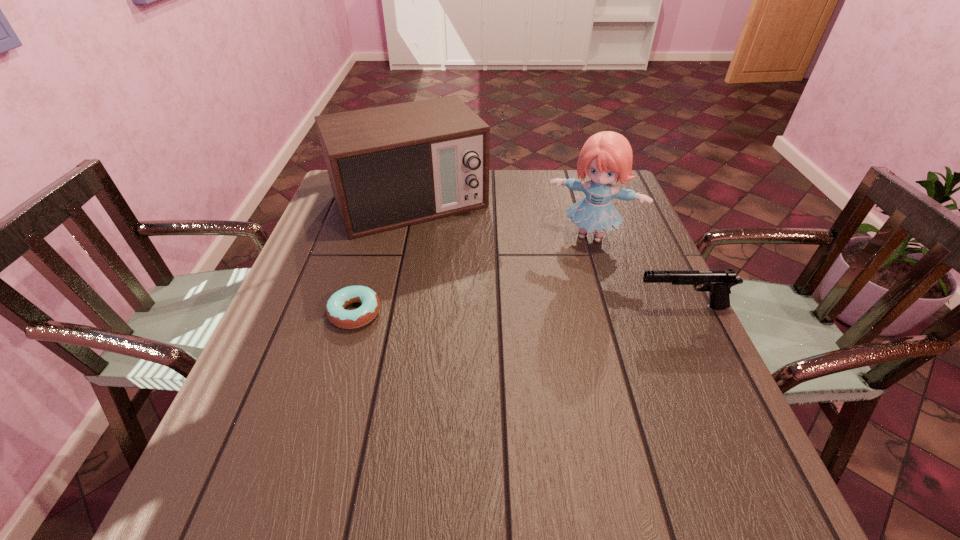
The width and height of the screenshot is (960, 540). I want to click on free space located on the front-facing side of the tallest object, so click(x=534, y=364).

The image size is (960, 540). I want to click on vacant space situated on the front-facing side of the radio receiver, so click(x=456, y=269).

Find the location of a particular element. The height and width of the screenshot is (540, 960). free space located 0.290m on the front-facing side of the radio receiver is located at coordinates (477, 306).

Identify the location of free space located 0.130m on the front-facing side of the radio receiver. (453, 265).

You are a GUI agent. You are given a task and a screenshot of the screen. Output one action in this format:
    pyautogui.click(x=<x>, y=<y>)
    Task: Click on the object that is at the far edge
    The image size is (960, 540).
    Given the screenshot: What is the action you would take?
    pyautogui.click(x=392, y=166)

Identify the location of doughnut at the left edge. (347, 319).

I want to click on radio receiver that is at the left edge, so click(392, 166).

Where is `gun that is positioned at the right edge`? This screenshot has width=960, height=540. gun that is positioned at the right edge is located at coordinates (717, 282).

Locate an element on the screen. doll present at the right edge is located at coordinates (606, 156).

The height and width of the screenshot is (540, 960). In order to click on object located in the far left corner section of the desktop in this screenshot , I will do `click(392, 166)`.